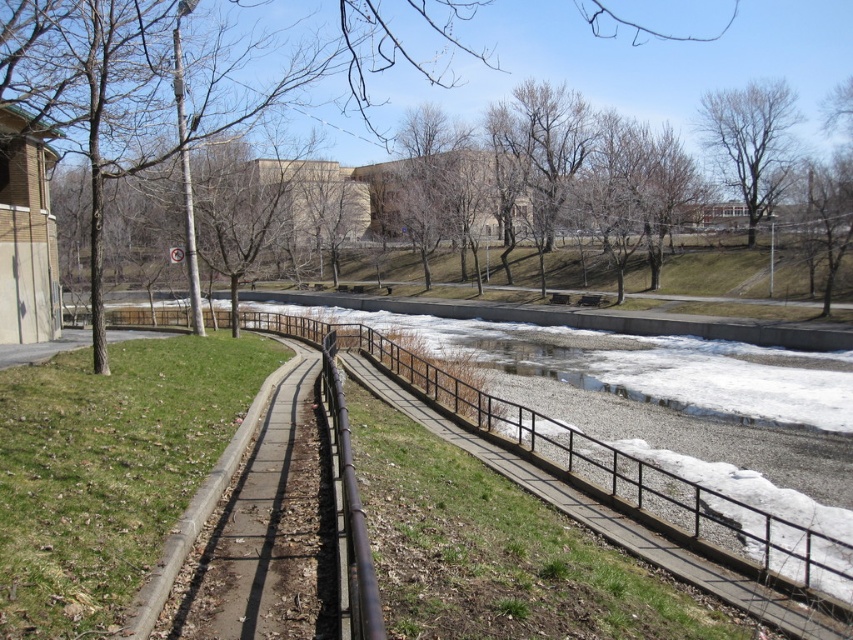
Question: Which of the following is the farthest from the observer?

Choices:
 (A) (770, 157)
 (B) (637, 538)
 (C) (335, 412)
 (D) (225, 100)

Answer: (A)

Question: Which is nearer to the black metal rail at center?

Choices:
 (A) brown leafless tree at upper center
 (B) brown metal rail at center
 (C) bare branches at upper center

Answer: (B)

Question: Can you confirm if black metal rail at center is wider than bare branches at upper center?

Choices:
 (A) no
 (B) yes

Answer: (A)

Question: Which of these objects is positioned farthest from the black metal rail at center?

Choices:
 (A) brown metal rail at center
 (B) brown leafless tree at upper center
 (C) bare branches at upper center

Answer: (C)

Question: Does black metal rail at center appear over brown metal rail at center?

Choices:
 (A) yes
 (B) no

Answer: (B)

Question: Can you confirm if black metal rail at center is smaller than bare branches at upper center?

Choices:
 (A) yes
 (B) no

Answer: (A)